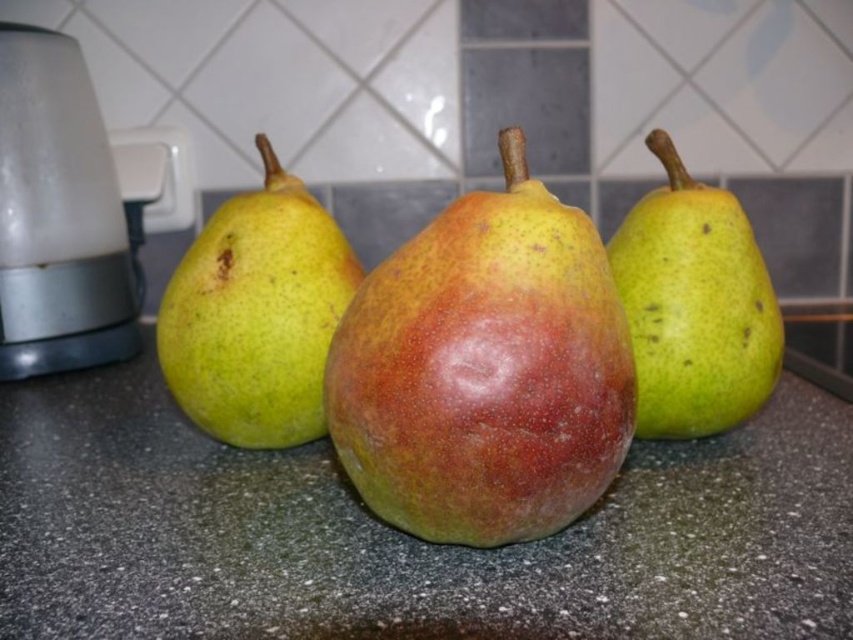
You are arranging fruits on a speckled granite countertop at center and a green matte pear at center for a photo shoot. According to the scene description, which object is located to the right of the other?

The speckled granite countertop at center is positioned on the right side of green matte pear at center, so the countertop is to the right of the pear.

You are arranging items on the speckled granite countertop at center and need to place the white plastic blender at left. Based on the scene, where should you position the blender relative to the countertop?

The white plastic blender at left should be placed above the speckled granite countertop at center since the countertop is below the blender according to the description.